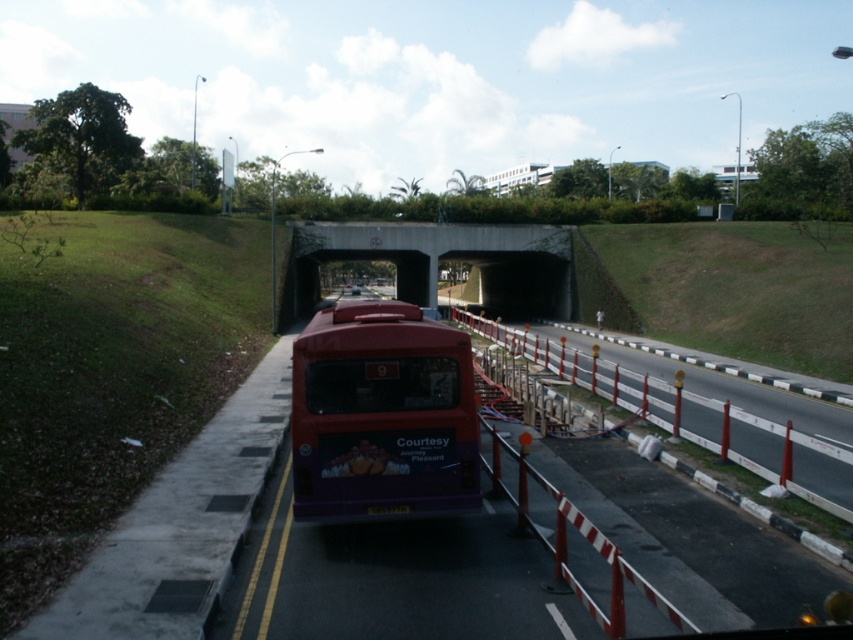
You are standing at the road intersection near the tunnel entrance. There is a red bus with the number 9 on its rear parked on the road. You see a point marked at coordinates (444, 259). What is located at that point?

The point at coordinates (444, 259) marks concrete at center.

Looking at this image, you are standing at the road intersection near the tunnel entrance. You see a point marked at coordinates (x=381, y=416). Which object does this point correspond to?

The point at coordinates (x=381, y=416) corresponds to the matte purple bus at center.

You are a pedestrian standing on the sidewalk. You see the matte purple bus at center and the concrete at center. Which object is closer to the ground?

The matte purple bus at center is closer to the ground because it is below the concrete at center.